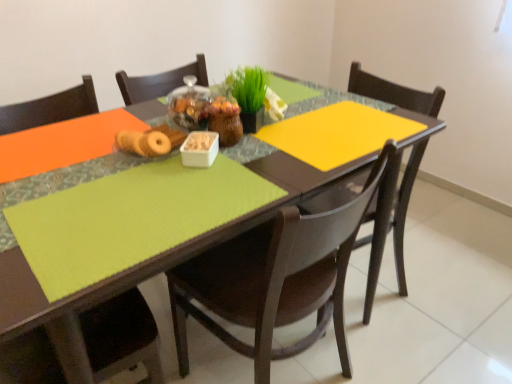
Where is `free space to the right of white plastic container at center`? The width and height of the screenshot is (512, 384). free space to the right of white plastic container at center is located at coordinates (264, 163).